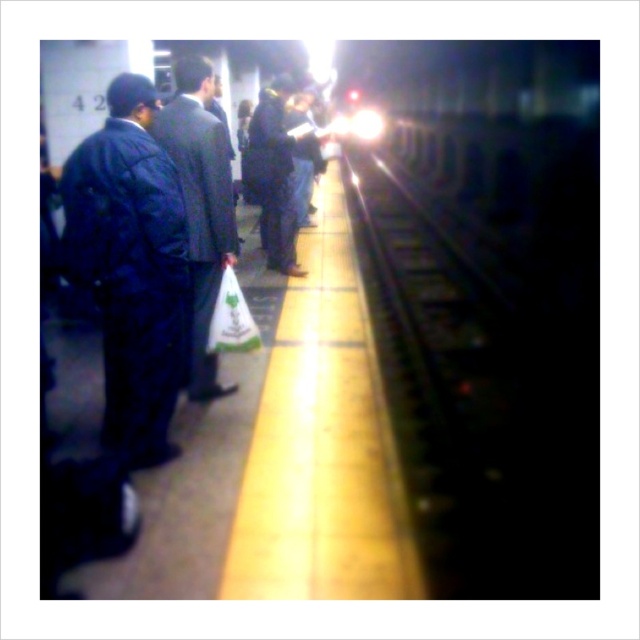
Question: Is dark blue jacket at left in front of white matte shopping bag at center?

Choices:
 (A) yes
 (B) no

Answer: (A)

Question: Which is farther from the dark blue jeans at center?

Choices:
 (A) white matte shopping bag at center
 (B) dark blue jacket at left
 (C) dark blue suit at center

Answer: (B)

Question: Observing the image, what is the correct spatial positioning of dark blue suit at center in reference to white matte shopping bag at center?

Choices:
 (A) above
 (B) below

Answer: (A)

Question: Can you confirm if dark blue jeans at center is positioned below white matte shopping bag at center?

Choices:
 (A) no
 (B) yes

Answer: (A)

Question: Estimate the real-world distances between objects in this image. Which object is farther from the dark blue jacket at left?

Choices:
 (A) dark blue jeans at center
 (B) white matte shopping bag at center
 (C) dark blue suit at center

Answer: (A)

Question: Estimate the real-world distances between objects in this image. Which object is closer to the white matte shopping bag at center?

Choices:
 (A) dark blue suit at center
 (B) dark blue jacket at left

Answer: (A)